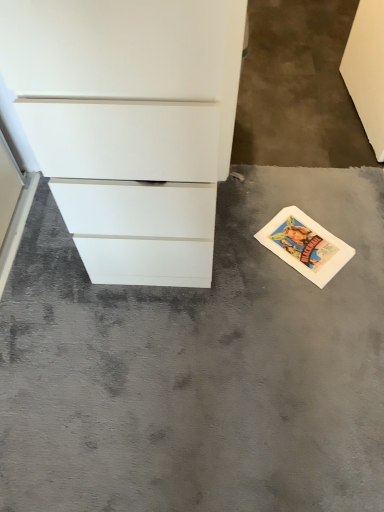
Question: Can you confirm if white matte chest of drawers at left is positioned to the right of gray concrete at lower right?

Choices:
 (A) yes
 (B) no

Answer: (B)

Question: Is white matte chest of drawers at left at the left side of gray concrete at lower right?

Choices:
 (A) no
 (B) yes

Answer: (B)

Question: Is white matte chest of drawers at left in front of gray concrete at lower right?

Choices:
 (A) no
 (B) yes

Answer: (B)

Question: Considering the relative sizes of white matte chest of drawers at left and gray concrete at lower right in the image provided, is white matte chest of drawers at left shorter than gray concrete at lower right?

Choices:
 (A) yes
 (B) no

Answer: (B)

Question: Does white matte chest of drawers at left turn towards gray concrete at lower right?

Choices:
 (A) no
 (B) yes

Answer: (B)

Question: Is white matte chest of drawers at left to the left or to the right of white paper postcard at lower right in the image?

Choices:
 (A) left
 (B) right

Answer: (A)

Question: Does point (109, 150) appear closer or farther from the camera than point (344, 245)?

Choices:
 (A) closer
 (B) farther

Answer: (B)

Question: Is white matte chest of drawers at left taller or shorter than white paper postcard at lower right?

Choices:
 (A) short
 (B) tall

Answer: (B)

Question: Is white matte chest of drawers at left wider or thinner than white paper postcard at lower right?

Choices:
 (A) thin
 (B) wide

Answer: (B)

Question: From the image's perspective, relative to gray concrete at lower right, is white matte chest of drawers at left above or below?

Choices:
 (A) below
 (B) above

Answer: (B)

Question: Considering the positions of white matte chest of drawers at left and gray concrete at lower right in the image, is white matte chest of drawers at left taller or shorter than gray concrete at lower right?

Choices:
 (A) tall
 (B) short

Answer: (A)

Question: Is white matte chest of drawers at left wider or thinner than gray concrete at lower right?

Choices:
 (A) thin
 (B) wide

Answer: (A)

Question: Looking at the image, does white matte chest of drawers at left seem bigger or smaller compared to gray concrete at lower right?

Choices:
 (A) small
 (B) big

Answer: (B)

Question: From a real-world perspective, is gray concrete at lower right physically located above or below white paper postcard at lower right?

Choices:
 (A) above
 (B) below

Answer: (A)

Question: Looking at the image, does gray concrete at lower right seem bigger or smaller compared to white paper postcard at lower right?

Choices:
 (A) big
 (B) small

Answer: (A)